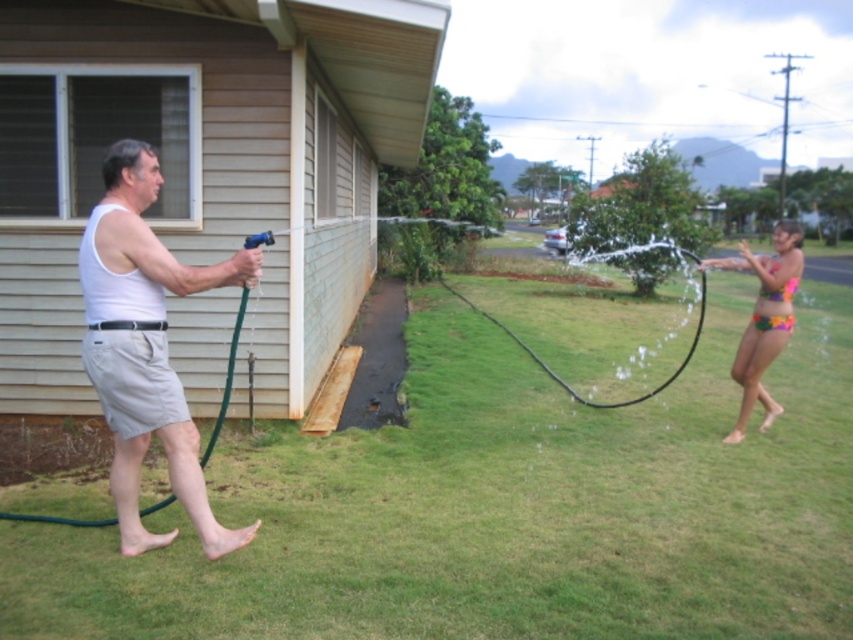
You are standing at the point labeled as point (27,536) in the image. You want to throw a water balloon to the person holding the hose. The person is 4.19 meters away from you. Can you reach them with a water balloon throw if the maximum distance you can throw is 4 meters?

The person holding the hose is 4.19 meters away from point (27,536), which is beyond your maximum throwing distance of 4 meters. Therefore, you cannot reach them with a water balloon throw.

You are a photographer trying to capture the multicolored fabric bikini top at right and the green grass at center in a single shot. Which object should you focus on first to ensure both are in frame?

The green grass at center is positioned under the multicolored fabric bikini top at right, so you should focus on the multicolored fabric bikini top at right first to ensure both are in frame.